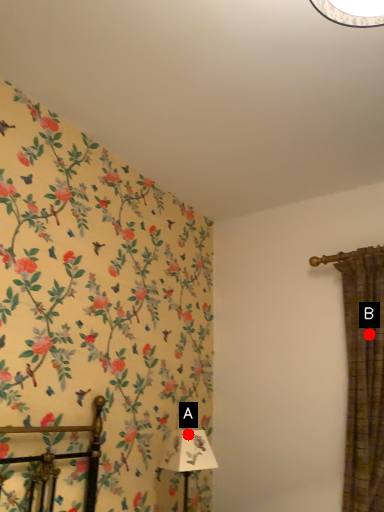
Question: Two points are circled on the image, labeled by A and B beside each circle. Which point is closer to the camera taking this photo?

Choices:
 (A) A is closer
 (B) B is closer

Answer: (A)